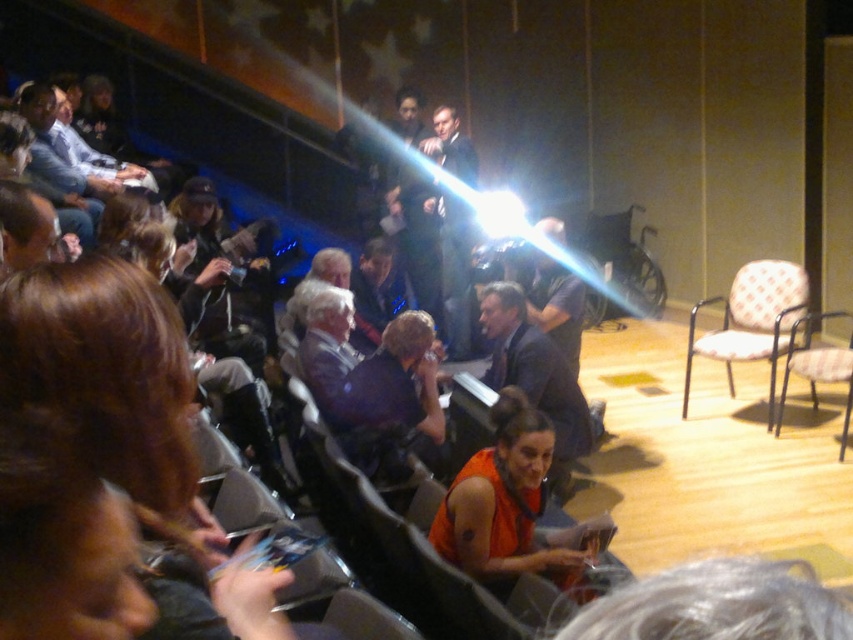
Question: Does orange sleeveless top at center appear on the left side of orange fabric tank top at center?

Choices:
 (A) no
 (B) yes

Answer: (B)

Question: Which point is closer to the camera taking this photo?

Choices:
 (A) (128, 346)
 (B) (770, 408)
 (C) (850, 346)

Answer: (A)

Question: Does orange sleeveless top at center appear on the right side of light beige fabric chair at right?

Choices:
 (A) yes
 (B) no

Answer: (B)

Question: Estimate the real-world distances between objects in this image. Which object is farther from the metallic gray chair at lower center?

Choices:
 (A) orange sleeveless top at center
 (B) white fabric chair at right
 (C) light beige fabric chair at right

Answer: (C)

Question: Observing the image, what is the correct spatial positioning of light beige fabric chair at right in reference to metallic gray chair at lower center?

Choices:
 (A) above
 (B) below

Answer: (A)

Question: Which object is the farthest from the light beige fabric chair at right?

Choices:
 (A) orange fabric tank top at center
 (B) orange sleeveless top at center

Answer: (B)